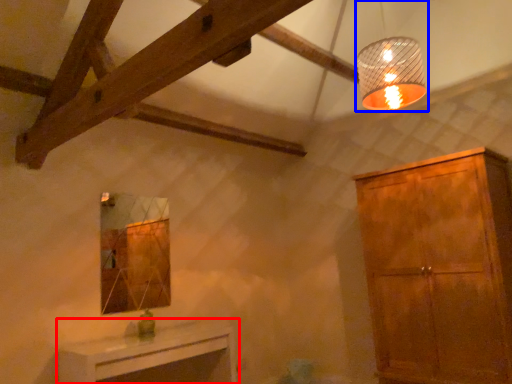
Question: Which object is further to the camera taking this photo, table (highlighted by a red box) or lamp (highlighted by a blue box)?

Choices:
 (A) table
 (B) lamp

Answer: (A)